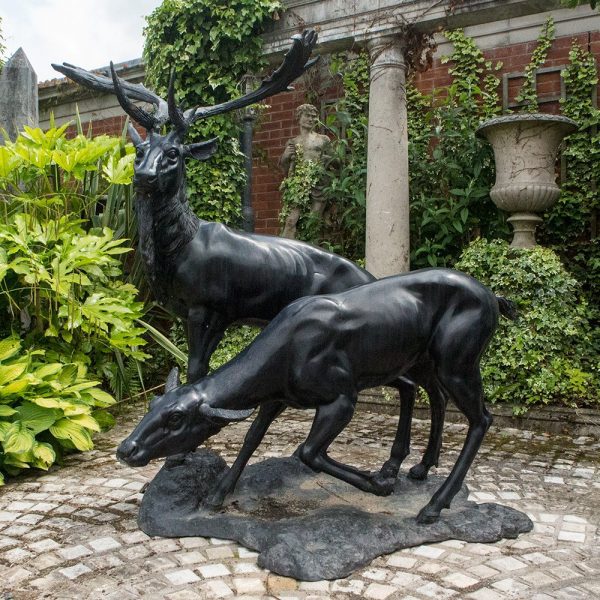
Locate an element on the screen. This screenshot has width=600, height=600. pillar is located at coordinates 387,143.